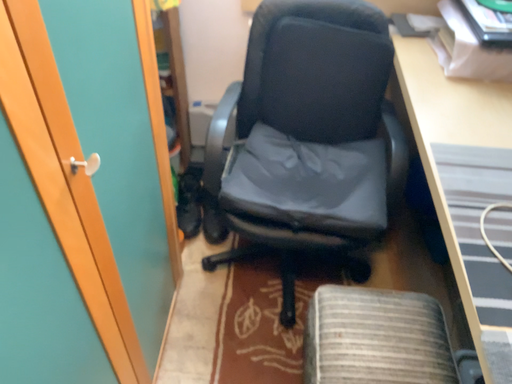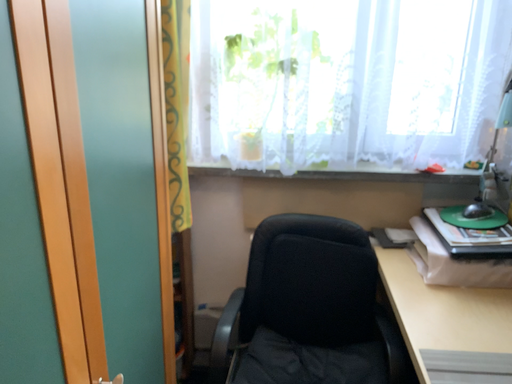
Question: Which way did the camera rotate in the video?

Choices:
 (A) rotated upward
 (B) rotated downward

Answer: (A)